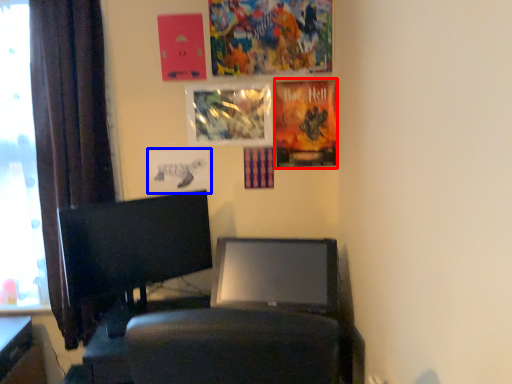
Question: Which object is further to the camera taking this photo, poster page (highlighted by a red box) or poster page (highlighted by a blue box)?

Choices:
 (A) poster page
 (B) poster page

Answer: (B)